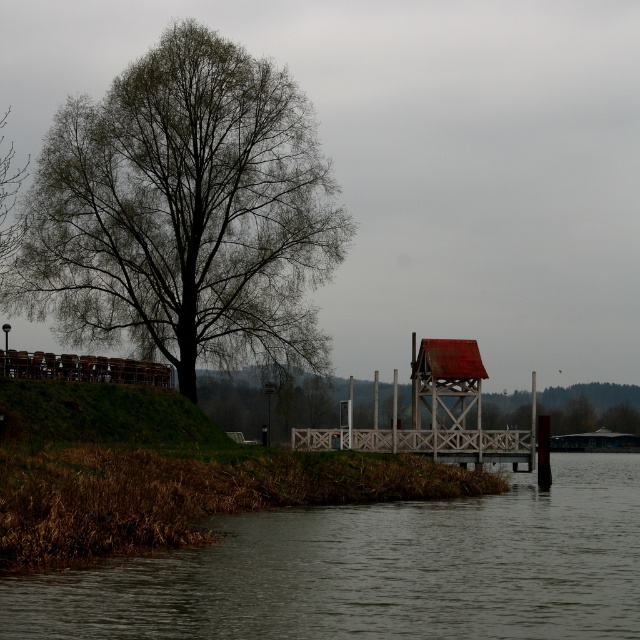
You are a hiker standing at the riverside. You want to take a photo of the green leafy tree at left and the brown matte river at lower left. Which object should you focus on first to ensure both are in sharp focus?

The brown matte river at lower left is behind the green leafy tree at left, so you should focus on the green leafy tree at left first since it is closer to you. This will ensure that both objects are in focus as the river is further away.

You are an environmental scientist assessing the scene. You need to determine which area covers more ground between the green leafy tree at left and the brown matte river at lower left. Based on the spatial information provided, which one occupies a larger area?

The brown matte river at lower left occupies more space than the green leafy tree at left.